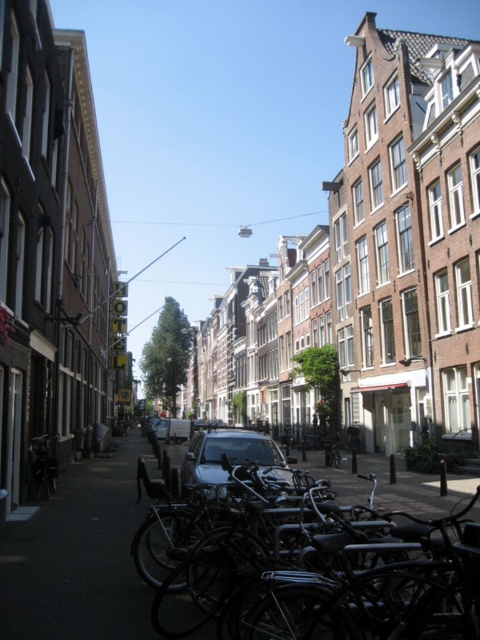
Question: In this image, where is shiny black car at center located relative to shiny black bicycle at lower left?

Choices:
 (A) above
 (B) below

Answer: (B)

Question: Is black matte bicycle at lower center to the right of shiny black car at center from the viewer's perspective?

Choices:
 (A) no
 (B) yes

Answer: (B)

Question: Which of the following is the closest to the observer?

Choices:
 (A) (31, 445)
 (B) (361, 563)

Answer: (B)

Question: In this image, where is shiny black car at center located relative to shiny black bicycle at lower left?

Choices:
 (A) left
 (B) right

Answer: (B)

Question: Considering the real-world distances, which object is closest to the black matte bicycle at lower center?

Choices:
 (A) shiny black car at center
 (B) shiny black bicycle at lower left

Answer: (A)

Question: Among these objects, which one is nearest to the camera?

Choices:
 (A) black matte bicycle at lower center
 (B) shiny black car at center
 (C) shiny black bicycle at lower left

Answer: (A)